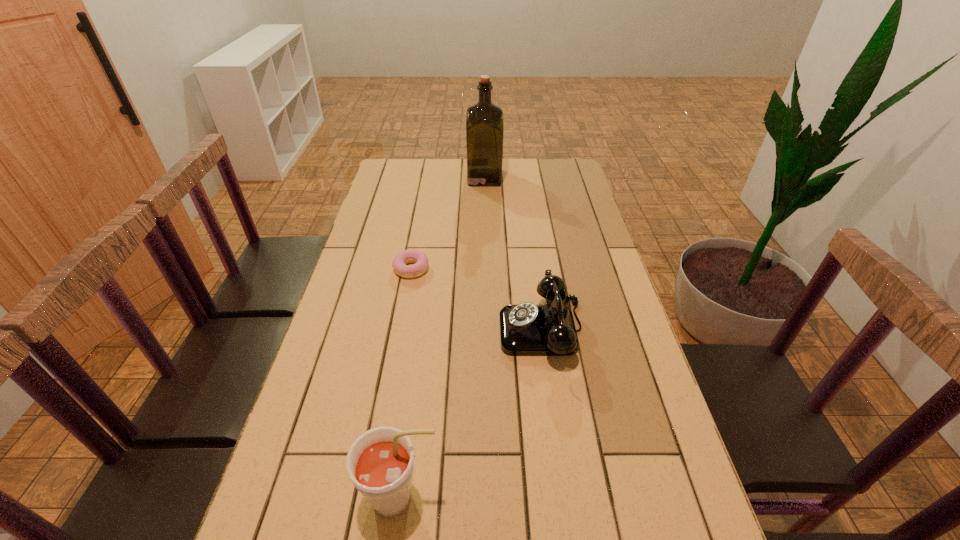
The height and width of the screenshot is (540, 960). In order to click on free point located 0.140m on the label of the liquor in this screenshot , I will do `click(434, 178)`.

The image size is (960, 540). I want to click on vacant space located 0.120m on the drink side of the nearest object, so click(502, 498).

You are a GUI agent. You are given a task and a screenshot of the screen. Output one action in this format:
    pyautogui.click(x=<x>, y=<y>)
    Task: Click on the vacant space located 0.400m on the dial of the second shortest object
    The width and height of the screenshot is (960, 540).
    Given the screenshot: What is the action you would take?
    pyautogui.click(x=351, y=329)

This screenshot has height=540, width=960. In order to click on vacant space located on the dial of the second shortest object in this screenshot , I will do `click(467, 329)`.

Where is `vacant space situated on the dial of the second shortest object`? The image size is (960, 540). vacant space situated on the dial of the second shortest object is located at coordinates (433, 329).

Image resolution: width=960 pixels, height=540 pixels. Identify the location of vacant point located 0.060m on the front of the second farthest object. (407, 294).

The height and width of the screenshot is (540, 960). Find the location of `object that is at the far edge`. object that is at the far edge is located at coordinates (484, 121).

I want to click on object positioned at the left edge, so click(x=420, y=259).

You are a GUI agent. You are given a task and a screenshot of the screen. Output one action in this format:
    pyautogui.click(x=<x>, y=<y>)
    Task: Click on the object situated at the right edge
    The image size is (960, 540).
    Given the screenshot: What is the action you would take?
    pyautogui.click(x=526, y=329)

In the image, there is a desktop. Where is `vacant space at the far edge`? The image size is (960, 540). vacant space at the far edge is located at coordinates 511,161.